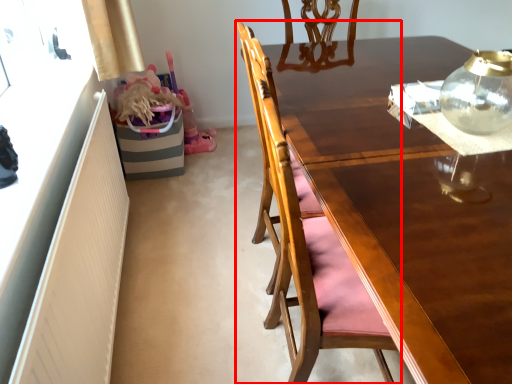
Question: From the image's perspective, what is the correct spatial positioning of chair (annotated by the red box) in reference to tea pot?

Choices:
 (A) above
 (B) below

Answer: (B)